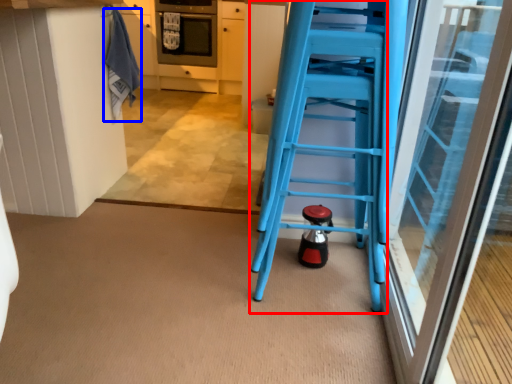
Question: Which point is further to the camera, ladder (highlighted by a red box) or laundry (highlighted by a blue box)?

Choices:
 (A) ladder
 (B) laundry

Answer: (B)